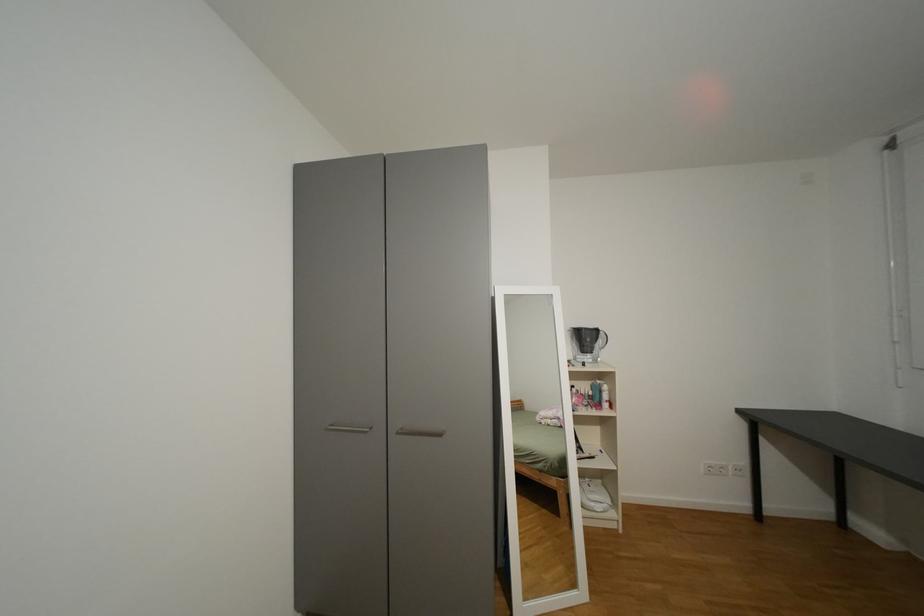
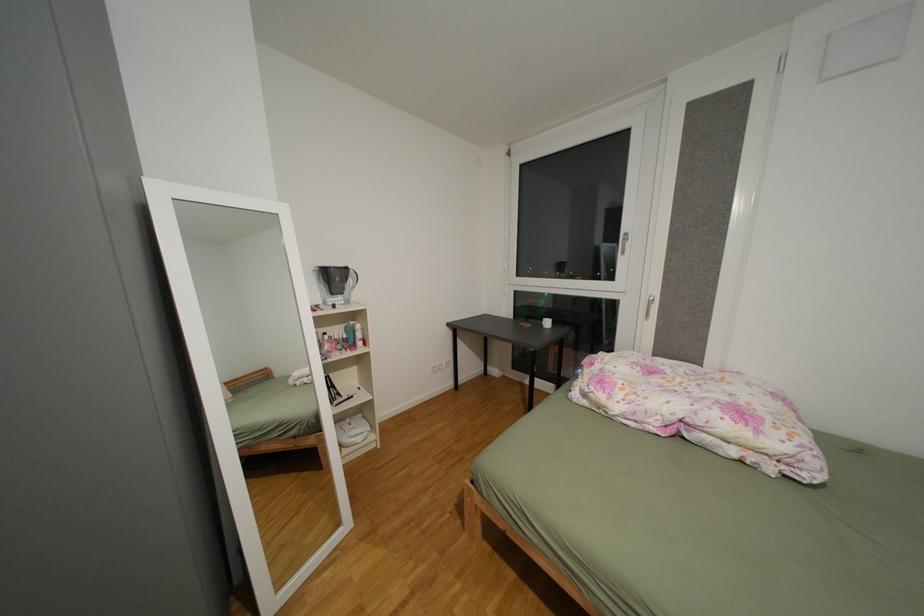
Question: Based on the continuous images, in which direction is the camera rotating? Reply with the corresponding letter.

Choices:
 (A) Left
 (B) Right
 (C) Up
 (D) Down

Answer: (B)